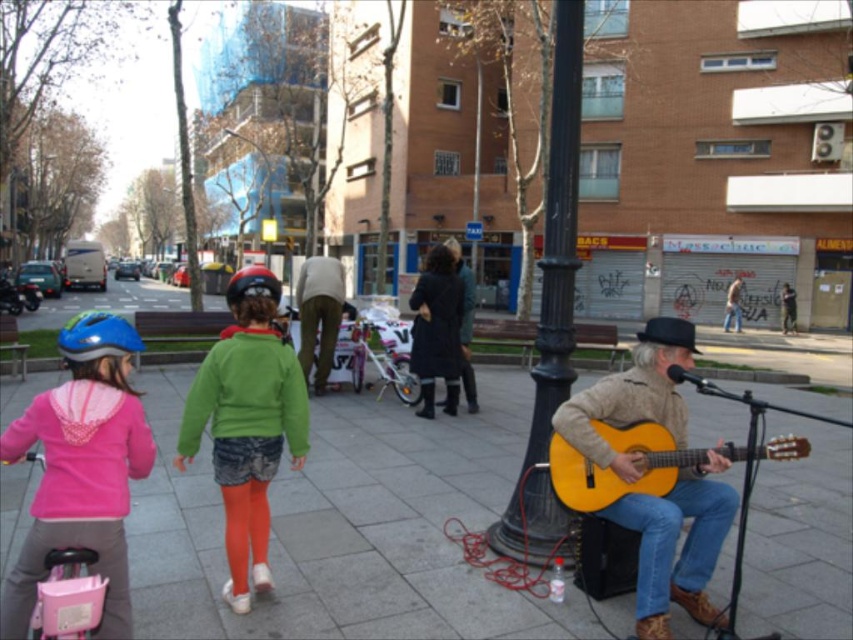
Question: Which object is positioned closest to the blue matte bicycle helmet at left?

Choices:
 (A) smooth concrete pavement at center
 (B) yellow matte guitar at lower right
 (C) black metal pole at center

Answer: (B)

Question: Which object appears farthest from the camera in this image?

Choices:
 (A) light brown pants at center
 (B) yellow matte guitar at lower right
 (C) pink fleece jacket at lower left
 (D) black metal pole at center

Answer: (A)

Question: Is smooth concrete pavement at center to the left of pink fleece jacket at lower left from the viewer's perspective?

Choices:
 (A) yes
 (B) no

Answer: (B)

Question: Is light brown pants at center below shiny red helmet at center?

Choices:
 (A) no
 (B) yes

Answer: (B)

Question: Considering the relative positions of yellow matte guitar at lower right and blue matte bicycle helmet at left in the image provided, where is yellow matte guitar at lower right located with respect to blue matte bicycle helmet at left?

Choices:
 (A) below
 (B) above

Answer: (A)

Question: Which point is closer to the camera?

Choices:
 (A) (42, 509)
 (B) (287, 429)
 (C) (300, 352)
 (D) (364, 474)

Answer: (A)